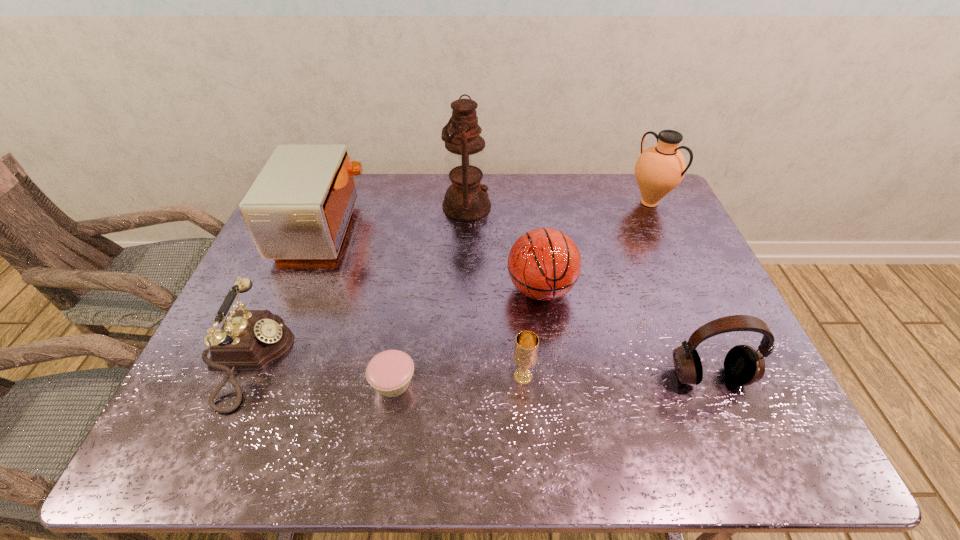
The image size is (960, 540). I want to click on free space located 0.230m on the front of the oil lamp, so click(x=464, y=276).

Find the location of a particular element. Image resolution: width=960 pixels, height=540 pixels. free space located on the front of the pitcher is located at coordinates (679, 266).

Where is `free point located on the door side of the toaster oven`? This screenshot has width=960, height=540. free point located on the door side of the toaster oven is located at coordinates (408, 228).

Where is `vacant point located 0.110m on the ear pads of the headset`? The height and width of the screenshot is (540, 960). vacant point located 0.110m on the ear pads of the headset is located at coordinates (736, 442).

You are a GUI agent. You are given a task and a screenshot of the screen. Output one action in this format:
    pyautogui.click(x=<x>, y=<y>)
    Task: Click on the free region located on the side with spill of the basketball
    The image size is (960, 540).
    Given the screenshot: What is the action you would take?
    pyautogui.click(x=551, y=370)

I want to click on vacant space located on the dial of the telephone, so click(x=420, y=359).

Where is `free spot located on the right of the chalice`? This screenshot has width=960, height=540. free spot located on the right of the chalice is located at coordinates (601, 376).

Find the location of a particular element. This screenshot has height=540, width=960. vacant space located 0.220m on the right of the shortest object is located at coordinates (515, 382).

Find the location of a particular element. The image size is (960, 540). oil lamp situated at the far edge is located at coordinates (466, 199).

You are a GUI agent. You are given a task and a screenshot of the screen. Output one action in this format:
    pyautogui.click(x=<x>, y=<y>)
    Task: Click on the pitcher positioned at the far edge
    
    Given the screenshot: What is the action you would take?
    pyautogui.click(x=659, y=169)